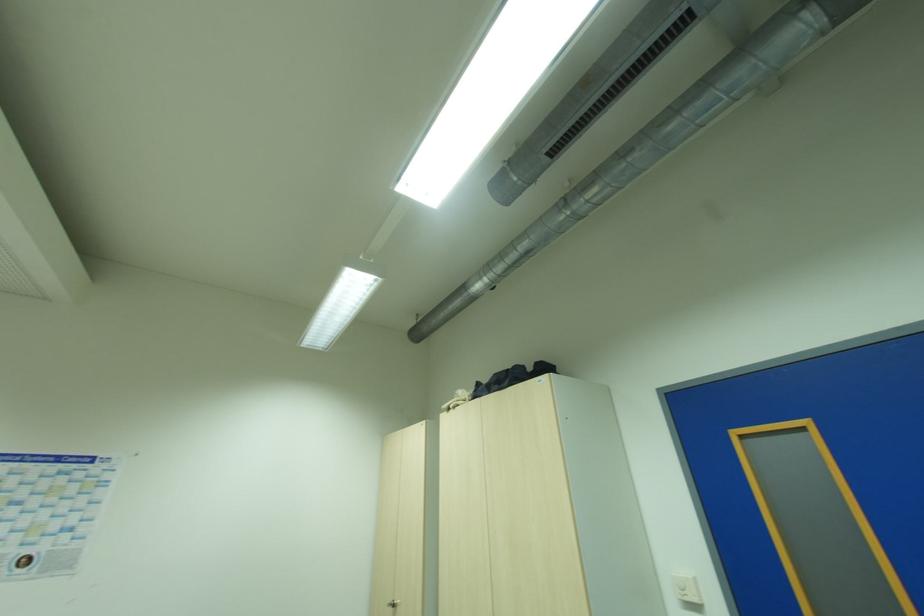
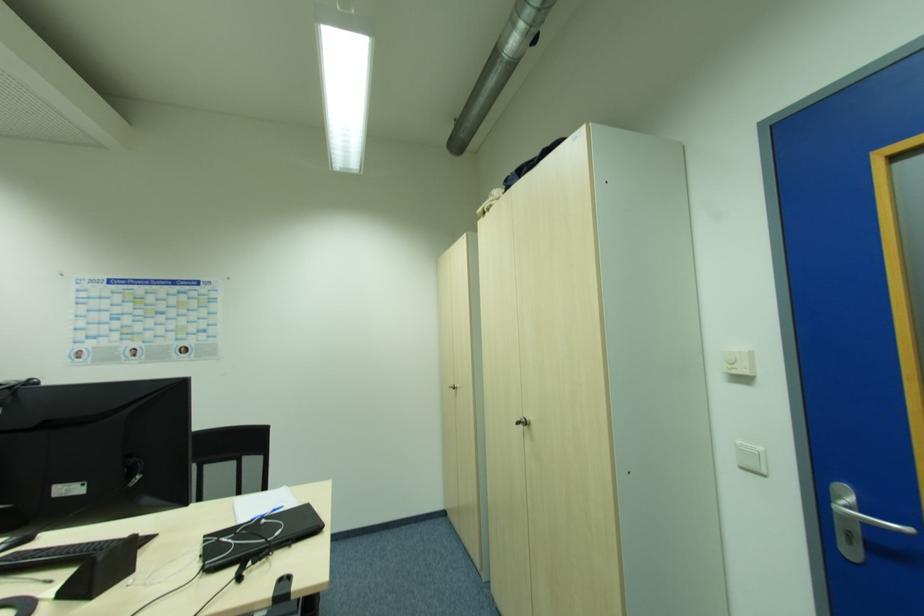
Looking at this image, which direction would the cameraman need to move to produce the second image?

The cameraman moved toward right, forward.